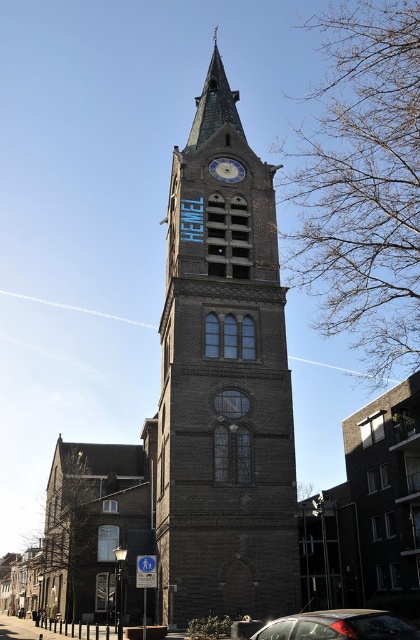
Between dark brown stone tower at center and metallic gray car at lower right, which one is positioned lower?

metallic gray car at lower right is lower down.

Does dark brown stone tower at center lie behind metallic gray car at lower right?

Yes, dark brown stone tower at center is further from the viewer.

Image resolution: width=420 pixels, height=640 pixels. Describe the element at coordinates (223, 384) in the screenshot. I see `dark brown stone tower at center` at that location.

Locate an element on the screen. This screenshot has width=420, height=640. dark brown stone tower at center is located at coordinates (223, 384).

Is point (338, 614) farther from viewer compared to point (230, 182)?

No, (338, 614) is in front of (230, 182).

Is point (330, 634) behind point (228, 164)?

No, it is in front of (228, 164).

I want to click on metallic gray car at lower right, so click(x=338, y=625).

Is dark brown stone tower at center further to camera compared to blue stone clock at center?

No, dark brown stone tower at center is in front of blue stone clock at center.

Is point (233, 548) closer to camera compared to point (212, 173)?

Yes, point (233, 548) is in front of point (212, 173).

At what (x,y) coordinates should I click in order to perform the action: click on dark brown stone tower at center. Please return your answer as a coordinate pair (x, y). The width and height of the screenshot is (420, 640). Looking at the image, I should click on (223, 384).